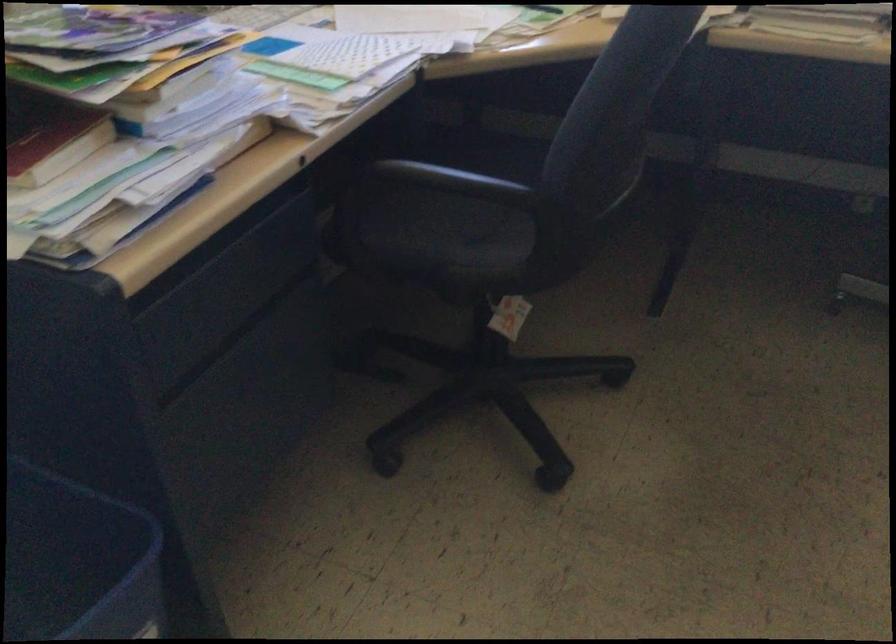
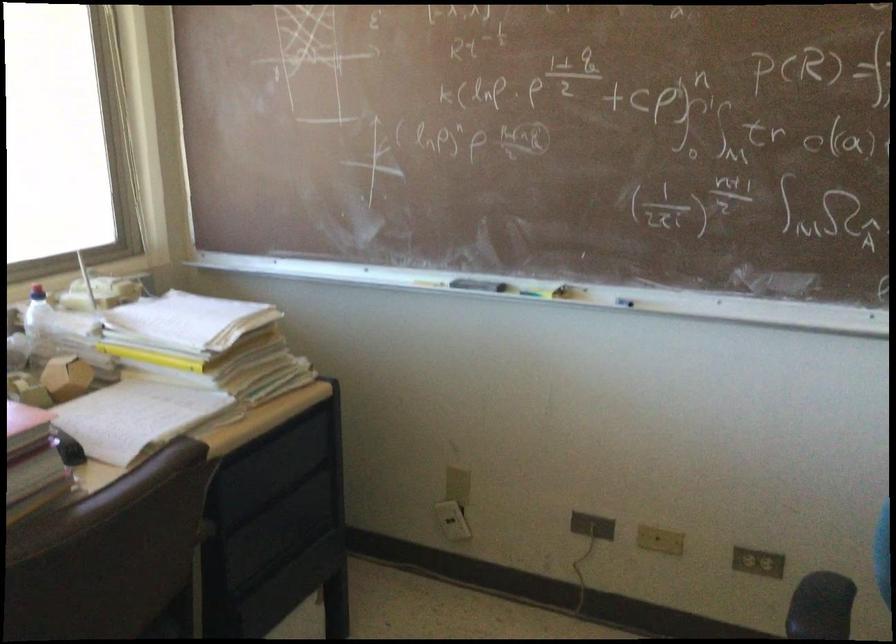
Question: How did the camera likely rotate?

Choices:
 (A) Left
 (B) Right
 (C) Up
 (D) Down

Answer: (B)